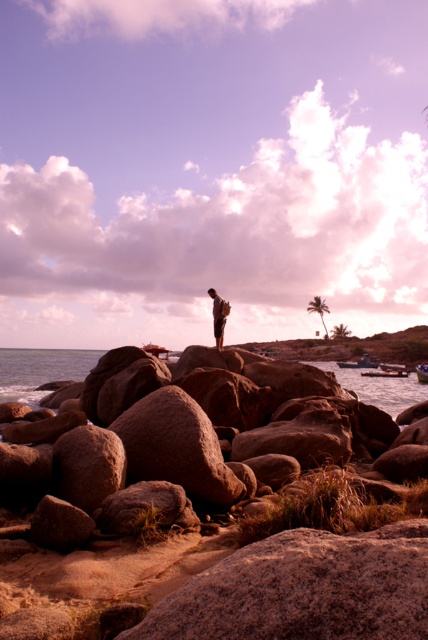
You are a photographer planning to capture the smooth brown water at center in the image. Based on the scene description, where should you position your camera to ensure the water is centered in your shot?

To center the smooth brown water at center in your shot, position your camera at the coordinates specified by the point mentioned in the description, which is at point (39, 371).

You are standing at the base of the green leafy palm tree at upper right in the coastal scene. If you look down towards the point marked at coordinates (318, 308), what would you see?

The point at coordinates (318, 308) is on the green leafy palm tree at upper right, so looking down from the base of the tree, you would see part of the tree itself at that location.